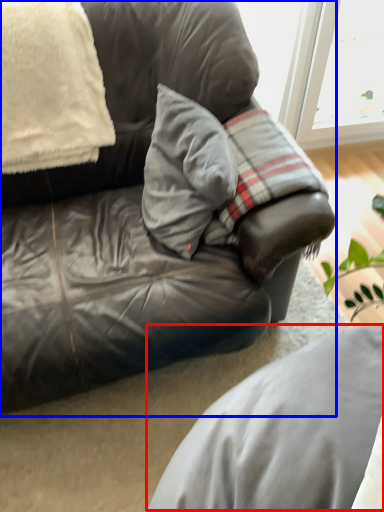
Question: Which of the following is the farthest to the observer, gray (highlighted by a red box) or studio couch (highlighted by a blue box)?

Choices:
 (A) gray
 (B) studio couch

Answer: (B)